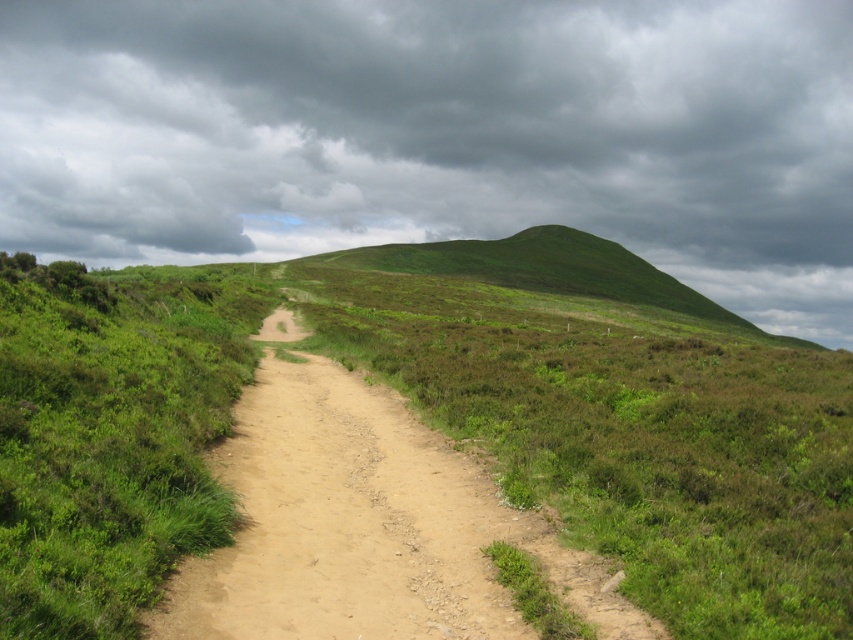
Is green grassy hill at upper center wider than brown sandy dirt track at center?

Yes, green grassy hill at upper center is wider than brown sandy dirt track at center.

Which of these two, green grassy hill at upper center or brown sandy dirt track at center, stands taller?

With more height is green grassy hill at upper center.

Who is more forward, [762,214] or [354,624]?

Point [354,624]

Where is `green grassy hill at upper center`? green grassy hill at upper center is located at coordinates (440, 134).